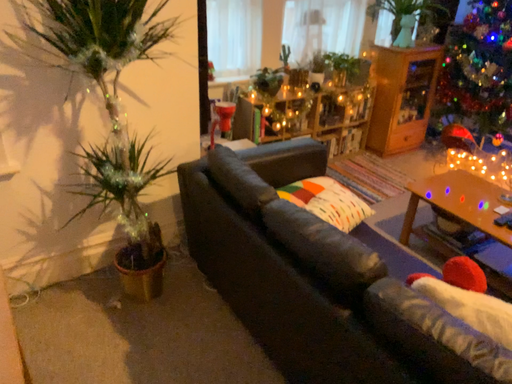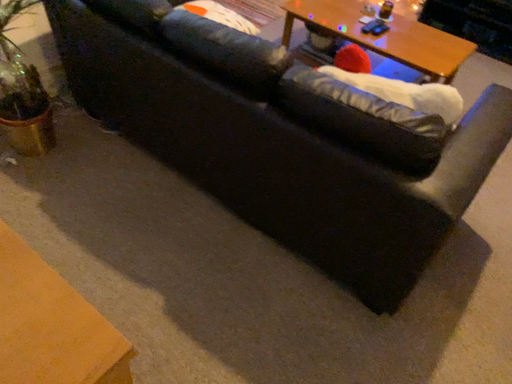
Question: Which way did the camera rotate in the video?

Choices:
 (A) rotated right
 (B) rotated left

Answer: (A)